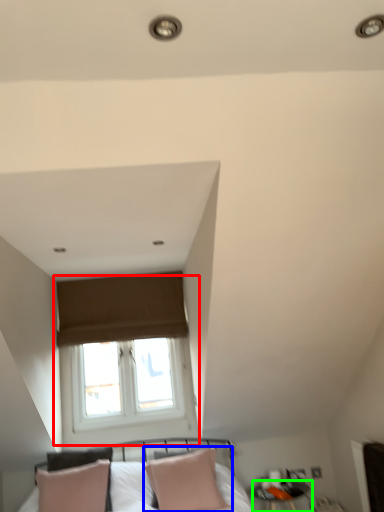
Question: Which is farther away from window (highlighted by a red box)? pillow (highlighted by a blue box) or side table (highlighted by a green box)?

Choices:
 (A) pillow
 (B) side table

Answer: (B)